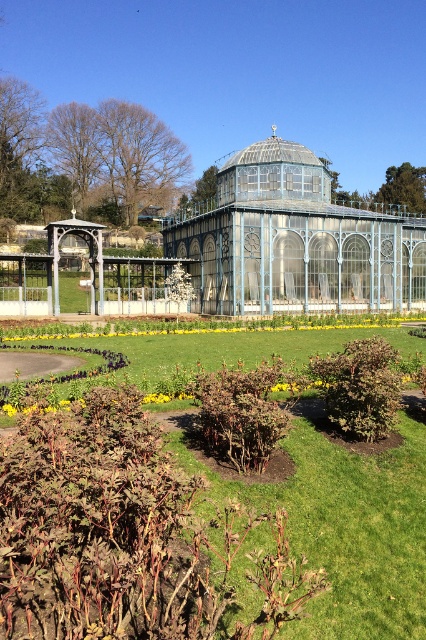
Question: Does green leafy bush at center have a lesser width compared to blue glass gazebo at center?

Choices:
 (A) yes
 (B) no

Answer: (A)

Question: Can you confirm if green leafy bush at center is positioned above blue glass gazebo at center?

Choices:
 (A) no
 (B) yes

Answer: (A)

Question: Which object appears farthest from the camera in this image?

Choices:
 (A) green leafy bush at center
 (B) blue glass gazebo at center

Answer: (B)

Question: Does green leafy bush at center appear on the right side of blue glass gazebo at center?

Choices:
 (A) yes
 (B) no

Answer: (B)

Question: Which point is closer to the camera?

Choices:
 (A) blue glass gazebo at center
 (B) green leafy bush at center

Answer: (B)